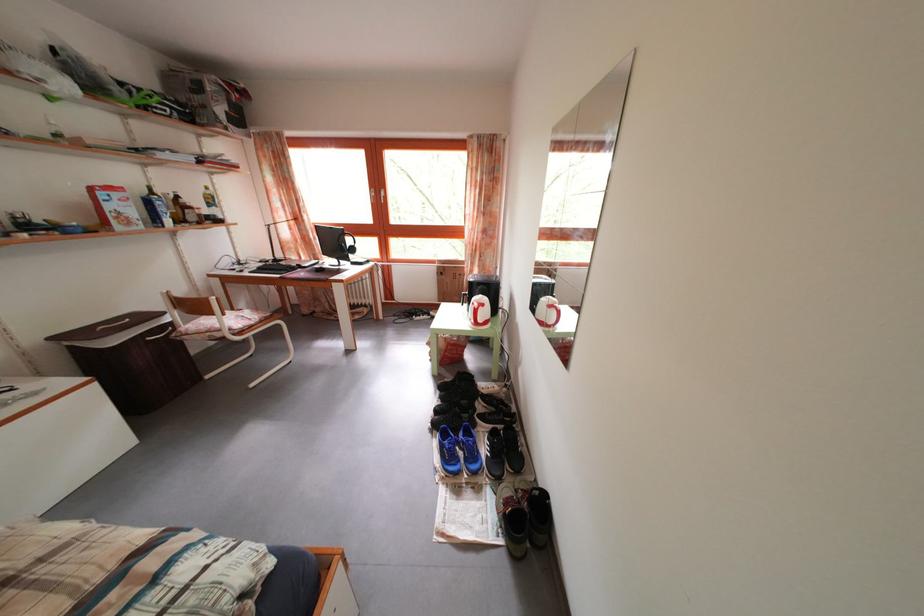
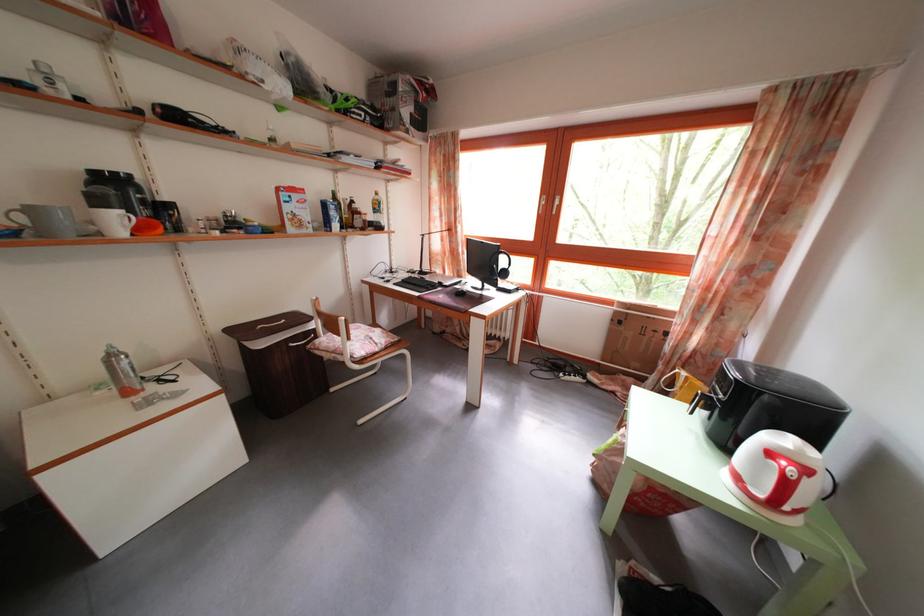
Find the pixel in the second image that matches the point at 490,312 in the first image.

(812, 477)